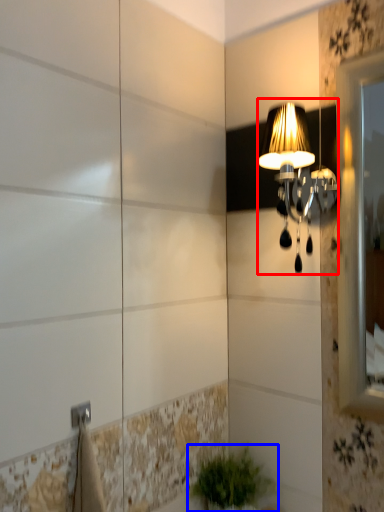
Question: Which object appears farthest to the camera in this image, lamp (highlighted by a red box) or houseplant (highlighted by a blue box)?

Choices:
 (A) lamp
 (B) houseplant

Answer: (B)